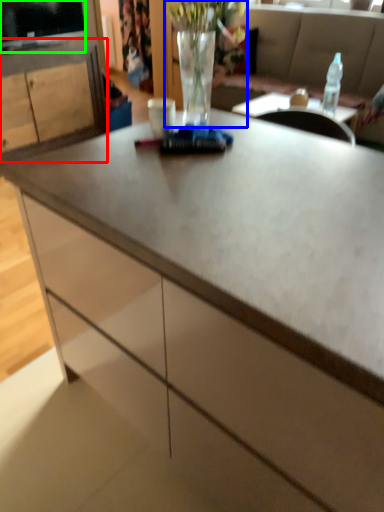
Question: Estimate the real-world distances between objects in this image. Which object is farther from cabinetry (highlighted by a red box), floral arrangement (highlighted by a blue box) or television (highlighted by a green box)?

Choices:
 (A) floral arrangement
 (B) television

Answer: (A)